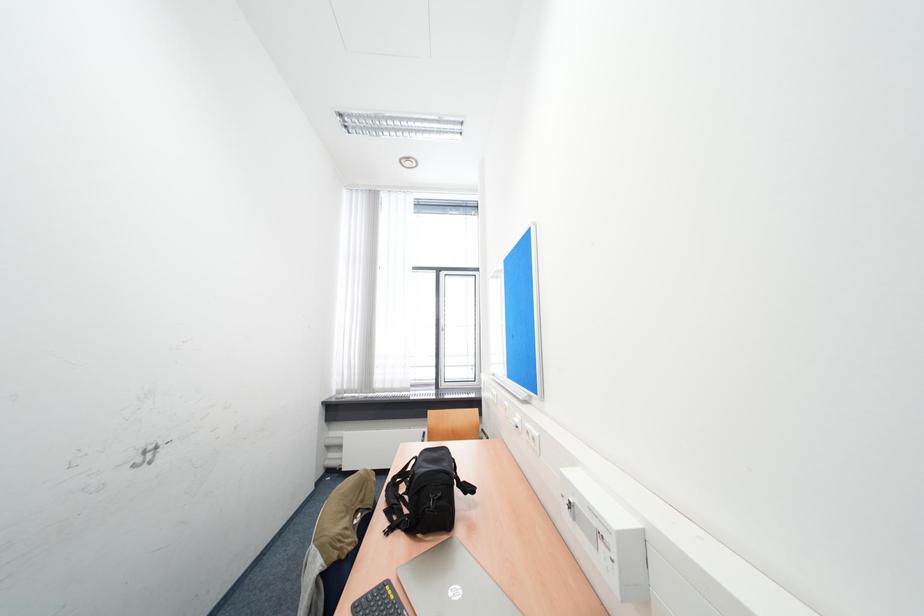
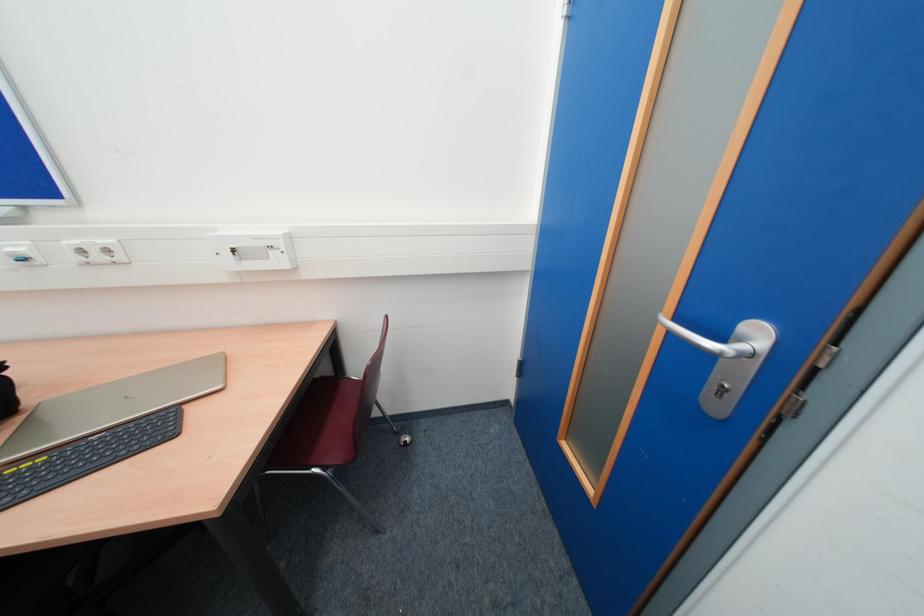
Based on the continuous images, in which direction is the camera rotating?

The camera's rotation is toward right-down.